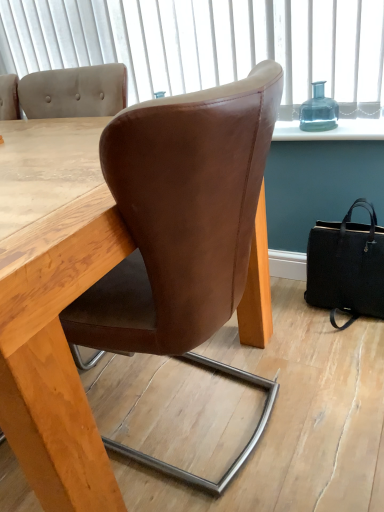
Question: Is black leather handbag at lower right thinner than brown leather chair at center?

Choices:
 (A) yes
 (B) no

Answer: (A)

Question: Is black leather handbag at lower right aimed at brown leather chair at center?

Choices:
 (A) no
 (B) yes

Answer: (A)

Question: Can you confirm if black leather handbag at lower right is smaller than brown leather chair at center?

Choices:
 (A) yes
 (B) no

Answer: (A)

Question: Is black leather handbag at lower right not near brown leather chair at center?

Choices:
 (A) no
 (B) yes

Answer: (A)

Question: Can you confirm if black leather handbag at lower right is wider than brown leather chair at center?

Choices:
 (A) no
 (B) yes

Answer: (A)

Question: From a real-world perspective, is black leather handbag at lower right physically above brown leather chair at center?

Choices:
 (A) no
 (B) yes

Answer: (A)

Question: Does brown leather chair at center have a greater width compared to black leather handbag at lower right?

Choices:
 (A) no
 (B) yes

Answer: (B)

Question: From the image's perspective, is brown leather chair at center below black leather handbag at lower right?

Choices:
 (A) yes
 (B) no

Answer: (A)

Question: Is brown leather chair at center with black leather handbag at lower right?

Choices:
 (A) no
 (B) yes

Answer: (A)

Question: From the image's perspective, is brown leather chair at center on black leather handbag at lower right?

Choices:
 (A) no
 (B) yes

Answer: (A)

Question: Is brown leather chair at center outside black leather handbag at lower right?

Choices:
 (A) no
 (B) yes

Answer: (B)

Question: Can you confirm if brown leather chair at center is bigger than black leather handbag at lower right?

Choices:
 (A) no
 (B) yes

Answer: (B)

Question: Is transparent glass bottle at upper right far from black leather handbag at lower right?

Choices:
 (A) yes
 (B) no

Answer: (B)